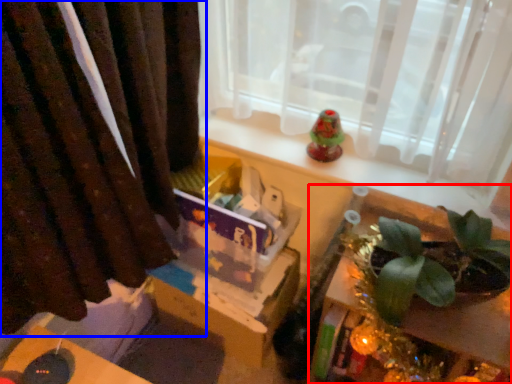
Question: Which object is further to the camera taking this photo, table (highlighted by a red box) or curtain (highlighted by a blue box)?

Choices:
 (A) table
 (B) curtain

Answer: (A)